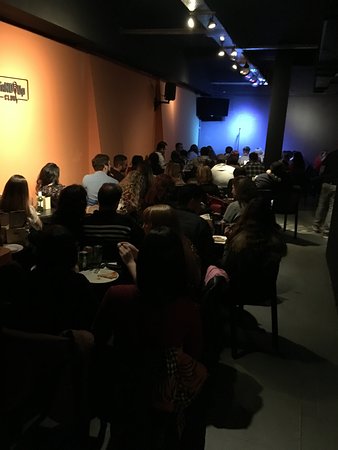
The image size is (338, 450). I want to click on floor, so click(313, 291), click(291, 409).